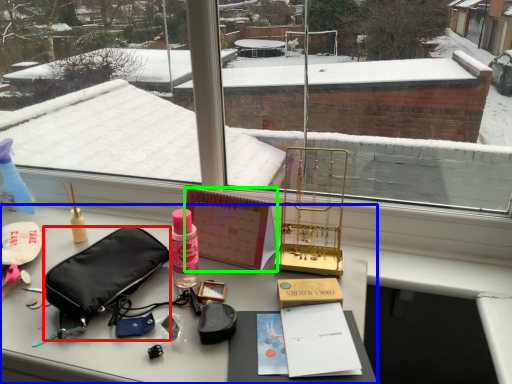
Question: Which object is positioned farthest from handbag (highlighted by a red box)? Select from desk (highlighted by a blue box) and book (highlighted by a green box).

Choices:
 (A) desk
 (B) book

Answer: (B)